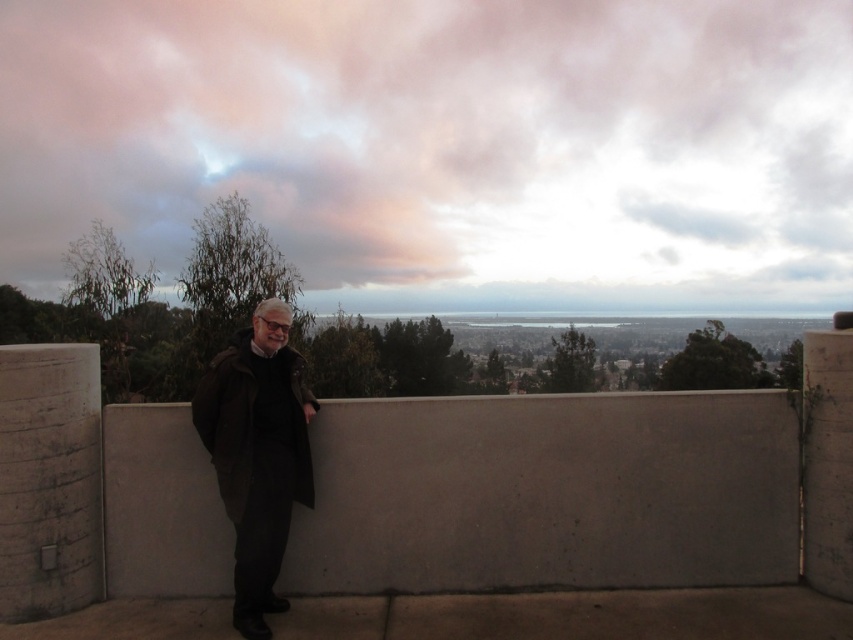
Question: Does pink fluffy cloud at upper center come in front of dark brown leather coat at center?

Choices:
 (A) no
 (B) yes

Answer: (A)

Question: Which point appears closest to the camera in this image?

Choices:
 (A) (234, 438)
 (B) (106, 577)
 (C) (267, 177)

Answer: (A)

Question: Estimate the real-world distances between objects in this image. Which object is farther from the dark brown leather coat at center?

Choices:
 (A) gray concrete ledge at center
 (B) pink fluffy cloud at upper center

Answer: (B)

Question: Is pink fluffy cloud at upper center below gray concrete ledge at center?

Choices:
 (A) yes
 (B) no

Answer: (B)

Question: Among these points, which one is nearest to the camera?

Choices:
 (A) (523, 275)
 (B) (422, 550)
 (C) (209, 435)

Answer: (C)

Question: Is pink fluffy cloud at upper center positioned in front of dark brown leather coat at center?

Choices:
 (A) no
 (B) yes

Answer: (A)